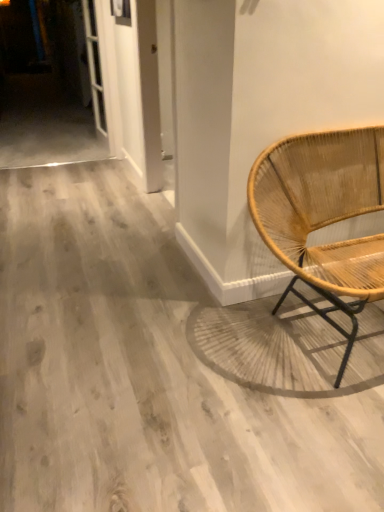
Locate an element on the screen. Image resolution: width=384 pixels, height=512 pixels. blank area beneath brown wicker chair at right (from a real-world perspective) is located at coordinates (317, 335).